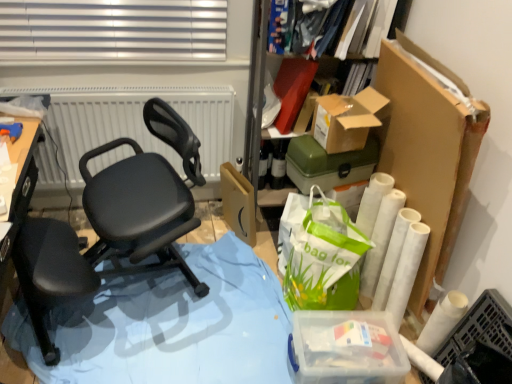
The image size is (512, 384). Describe the element at coordinates (136, 122) in the screenshot. I see `matte white radiator at upper center` at that location.

Measure the distance between point [198,367] and camera.

The distance of point [198,367] from camera is 1.55 meters.

What do you see at coordinates (104, 233) in the screenshot? The height and width of the screenshot is (384, 512). I see `matte black office chair at center` at bounding box center [104, 233].

Where is `clear plastic container at lower right, arranged as the first storage box when ordered from the bottom`? The width and height of the screenshot is (512, 384). clear plastic container at lower right, arranged as the first storage box when ordered from the bottom is located at coordinates (346, 348).

Does point (350, 172) lie behind point (177, 284)?

No, it is in front of (177, 284).

Is green plastic storage box at upper right, placed as the first storage box when sorted from top to bottom, positioned far away from blue plastic table at lower left?

No, there isn't a large distance between green plastic storage box at upper right, placed as the first storage box when sorted from top to bottom, and blue plastic table at lower left.

Is green plastic storage box at upper right, the 2th storage box positioned from the bottom, at the left side of blue plastic table at lower left?

In fact, green plastic storage box at upper right, the 2th storage box positioned from the bottom, is to the right of blue plastic table at lower left.

From the picture: From the image's perspective, is green plastic storage box at upper right, placed as the first storage box when sorted from top to bottom, above blue plastic table at lower left?

Yes.

From the image's perspective, which is above, matte white radiator at upper center or matte black office chair at center?

matte white radiator at upper center, from the image's perspective.

This screenshot has width=512, height=384. Identify the location of radiator above the matte black office chair at center (from the image's perspective). (136, 122).

Considering the relative positions of matte white radiator at upper center and matte black office chair at center in the image provided, is matte white radiator at upper center to the left or to the right of matte black office chair at center?

In the image, matte white radiator at upper center appears on the left side of matte black office chair at center.

What's the angular difference between matte white radiator at upper center and green plastic storage box at upper right, placed as the first storage box when sorted from top to bottom,'s facing directions?

77.9 degrees.

Is matte white radiator at upper center taller than green plastic storage box at upper right, placed as the first storage box when sorted from top to bottom?

Correct, matte white radiator at upper center is much taller as green plastic storage box at upper right, placed as the first storage box when sorted from top to bottom.

From a real-world perspective, is matte white radiator at upper center located higher than green plastic storage box at upper right, placed as the first storage box when sorted from top to bottom?

No, from a real-world perspective, matte white radiator at upper center is not above green plastic storage box at upper right, placed as the first storage box when sorted from top to bottom.

Is matte white radiator at upper center next to green plastic storage box at upper right, placed as the first storage box when sorted from top to bottom, and touching it?

matte white radiator at upper center and green plastic storage box at upper right, placed as the first storage box when sorted from top to bottom, are not in contact.

From the picture: Looking at the image, does blue plastic table at lower left seem bigger or smaller compared to matte brown cardboard box at center?

Clearly, blue plastic table at lower left is larger in size than matte brown cardboard box at center.

Would you say blue plastic table at lower left is inside or outside matte brown cardboard box at center?

blue plastic table at lower left is not enclosed by matte brown cardboard box at center.

Measure the distance from blue plastic table at lower left to matte brown cardboard box at center.

blue plastic table at lower left and matte brown cardboard box at center are 17.65 inches apart.

Who is taller, blue plastic table at lower left or matte brown cardboard box at center?

With more height is matte brown cardboard box at center.

You are a GUI agent. You are given a task and a screenshot of the screen. Output one action in this format:
    pyautogui.click(x=<x>, y=<y>)
    Task: Click on the 2nd storage box below the matte white radiator at upper center (from the image's perspective)
    The image size is (512, 384).
    Given the screenshot: What is the action you would take?
    pyautogui.click(x=346, y=348)

Does matte white radiator at upper center have a greater width compared to clear plastic container at lower right, which ranks as the 2th storage box in top-to-bottom order?

Incorrect, the width of matte white radiator at upper center does not surpass that of clear plastic container at lower right, which ranks as the 2th storage box in top-to-bottom order.

Considering the positions of objects matte white radiator at upper center and clear plastic container at lower right, which ranks as the 2th storage box in top-to-bottom order, in the image provided, who is more to the left, matte white radiator at upper center or clear plastic container at lower right, which ranks as the 2th storage box in top-to-bottom order,?

matte white radiator at upper center is more to the left.

Based on the photo, which is in front, matte white radiator at upper center or clear plastic container at lower right, which ranks as the 2th storage box in top-to-bottom order?

clear plastic container at lower right, which ranks as the 2th storage box in top-to-bottom order, is more forward.

Between matte black office chair at center and blue plastic table at lower left, which one has larger size?

matte black office chair at center.

From a real-world perspective, which object stands above the other?

matte black office chair at center is physically above.

From a real-world perspective, is matte black office chair at center above or below matte white radiator at upper center?

In terms of real-world spatial position, matte black office chair at center is below matte white radiator at upper center.

Would you consider matte black office chair at center to be distant from matte white radiator at upper center?

They are positioned close to each other.

Can you confirm if matte black office chair at center is taller than matte white radiator at upper center?

Yes, matte black office chair at center is taller than matte white radiator at upper center.

Image resolution: width=512 pixels, height=384 pixels. In order to click on chair in front of the matte white radiator at upper center in this screenshot , I will do `click(104, 233)`.

This screenshot has width=512, height=384. I want to click on table in front of the green plastic storage box at upper right, placed as the first storage box when sorted from top to bottom, so click(x=170, y=325).

Locate an element on the screen. The width and height of the screenshot is (512, 384). radiator positioned vertically above the matte black office chair at center (from a real-world perspective) is located at coordinates (136, 122).

From the image, which object appears to be nearer to matte black office chair at center, green plastic storage box at upper right, placed as the first storage box when sorted from top to bottom, or cardboard box at upper right?

Based on the image, green plastic storage box at upper right, placed as the first storage box when sorted from top to bottom, appears to be nearer to matte black office chair at center.

From the image, which object appears to be nearer to matte white radiator at upper center, matte black office chair at center or matte brown cardboard box at center?

matte black office chair at center is closer to matte white radiator at upper center.

Which object lies further to the anchor point matte white radiator at upper center, clear plastic container at lower right, which ranks as the 2th storage box in top-to-bottom order, or cardboard box at upper right?

clear plastic container at lower right, which ranks as the 2th storage box in top-to-bottom order, is further to matte white radiator at upper center.

Based on their spatial positions, is green plastic storage box at upper right, placed as the first storage box when sorted from top to bottom, or cardboard box at upper right closer to matte brown cardboard box at center?

green plastic storage box at upper right, placed as the first storage box when sorted from top to bottom, is closer to matte brown cardboard box at center.

Considering their positions, is green plastic storage box at upper right, placed as the first storage box when sorted from top to bottom, positioned further to matte white radiator at upper center than blue plastic table at lower left?

blue plastic table at lower left lies further to matte white radiator at upper center than the other object.

Estimate the real-world distances between objects in this image. Which object is closer to matte white radiator at upper center, matte brown cardboard box at center or cardboard box at upper right?

The object closer to matte white radiator at upper center is matte brown cardboard box at center.

Considering their positions, is clear plastic container at lower right, which ranks as the 2th storage box in top-to-bottom order, positioned closer to cardboard box at upper right than matte brown cardboard box at center?

matte brown cardboard box at center is closer to cardboard box at upper right.

Looking at this image, from the image, which object appears to be farther from clear plastic container at lower right, arranged as the first storage box when ordered from the bottom, matte white radiator at upper center or blue plastic table at lower left?

matte white radiator at upper center is positioned further to the anchor clear plastic container at lower right, arranged as the first storage box when ordered from the bottom.

Identify the location of table located between matte white radiator at upper center and green plastic storage box at upper right, placed as the first storage box when sorted from top to bottom, in the left-right direction. (170, 325).

Find the location of `chair between matte white radiator at upper center and clear plastic container at lower right, which ranks as the 2th storage box in top-to-bottom order, in the horizontal direction`. chair between matte white radiator at upper center and clear plastic container at lower right, which ranks as the 2th storage box in top-to-bottom order, in the horizontal direction is located at coordinates (104, 233).

Locate an element on the screen. chair between matte white radiator at upper center and cardboard box at upper right in the horizontal direction is located at coordinates pyautogui.click(x=104, y=233).

Where is `cardboard box between matte black office chair at center and cardboard box at upper right from left to right`? This screenshot has height=384, width=512. cardboard box between matte black office chair at center and cardboard box at upper right from left to right is located at coordinates (238, 203).